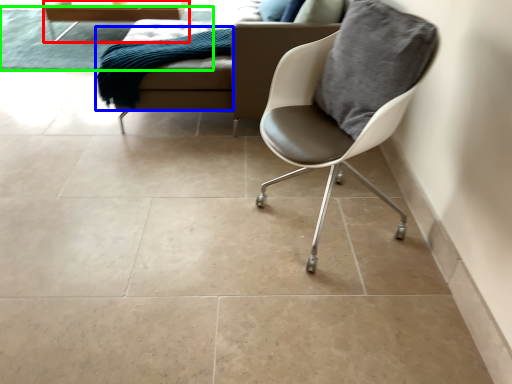
Question: Based on their relative distances, which object is nearer to table (highlighted by a red box)? Choose from material (highlighted by a blue box) and mat (highlighted by a green box).

Choices:
 (A) material
 (B) mat

Answer: (B)